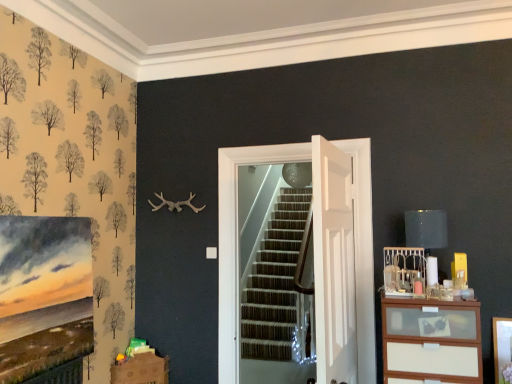
Question: From the image's perspective, relative to white wood chest of drawers at right, is brown cardboard drawer at lower left above or below?

Choices:
 (A) below
 (B) above

Answer: (A)

Question: Would you say brown cardboard drawer at lower left is to the left or to the right of white wood chest of drawers at right in the picture?

Choices:
 (A) left
 (B) right

Answer: (A)

Question: Which is farther from the white wood chest of drawers at right?

Choices:
 (A) white wooden door at center, the first door from the back
 (B) matte black lampshade at upper right
 (C) white glossy door at center, the 2th door when ordered from back to front
 (D) brown cardboard drawer at lower left

Answer: (D)

Question: Which is farther from the white wooden door at center, the first door from the back?

Choices:
 (A) white glossy door at center, the 1th door in the front-to-back sequence
 (B) matte black lampshade at upper right
 (C) white wood chest of drawers at right
 (D) brown cardboard drawer at lower left

Answer: (D)